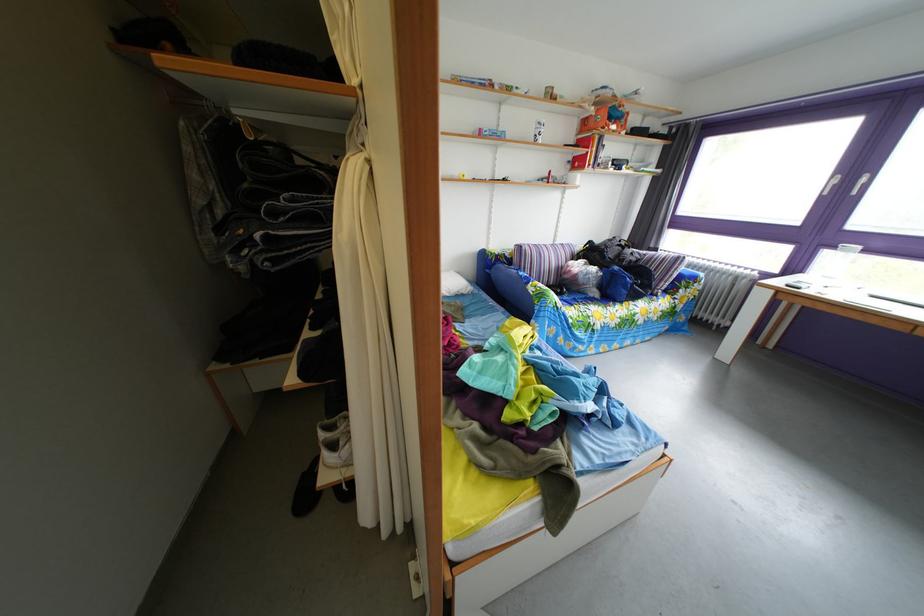
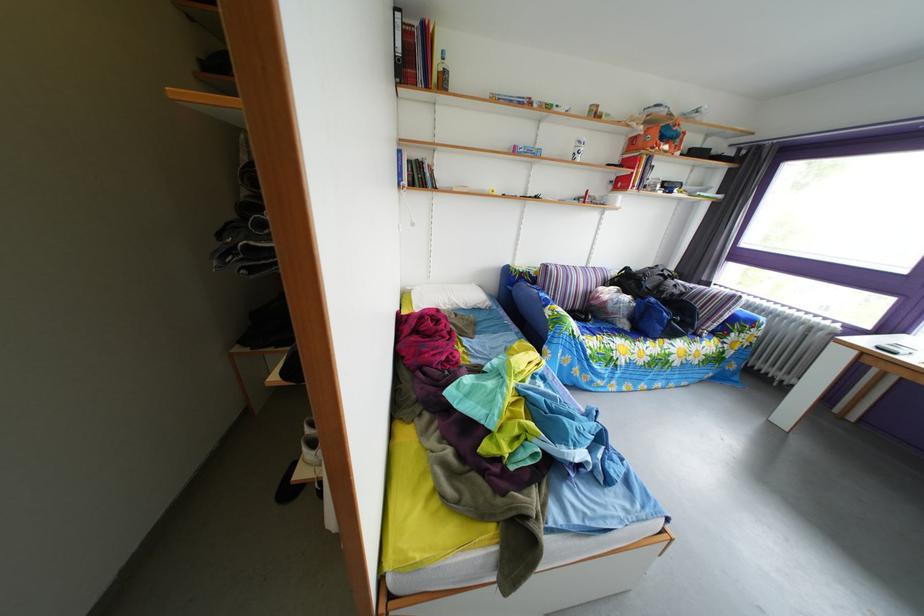
Locate, in the second image, the point that corresponds to pixel 627 276 in the first image.

(663, 307)